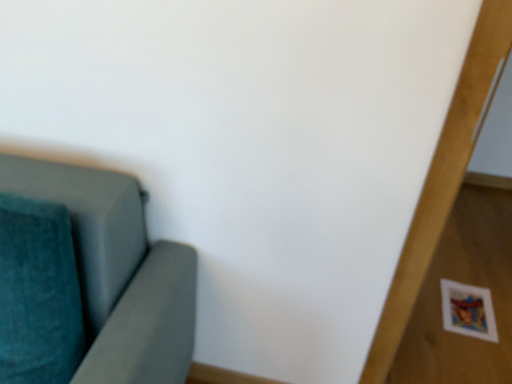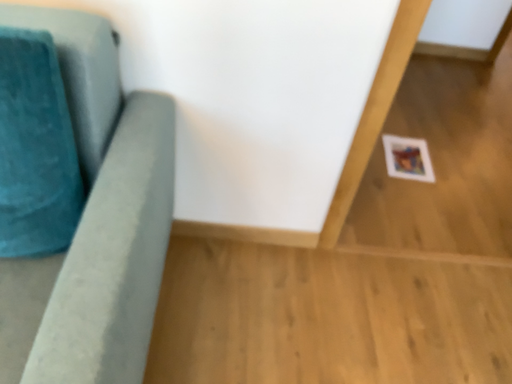
Question: Which way did the camera rotate in the video?

Choices:
 (A) rotated right
 (B) rotated left

Answer: (A)